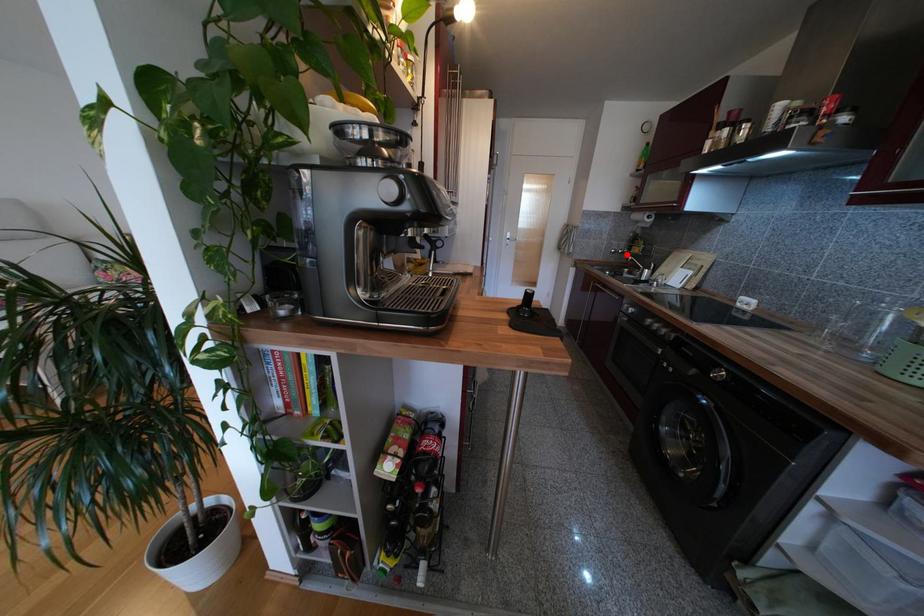
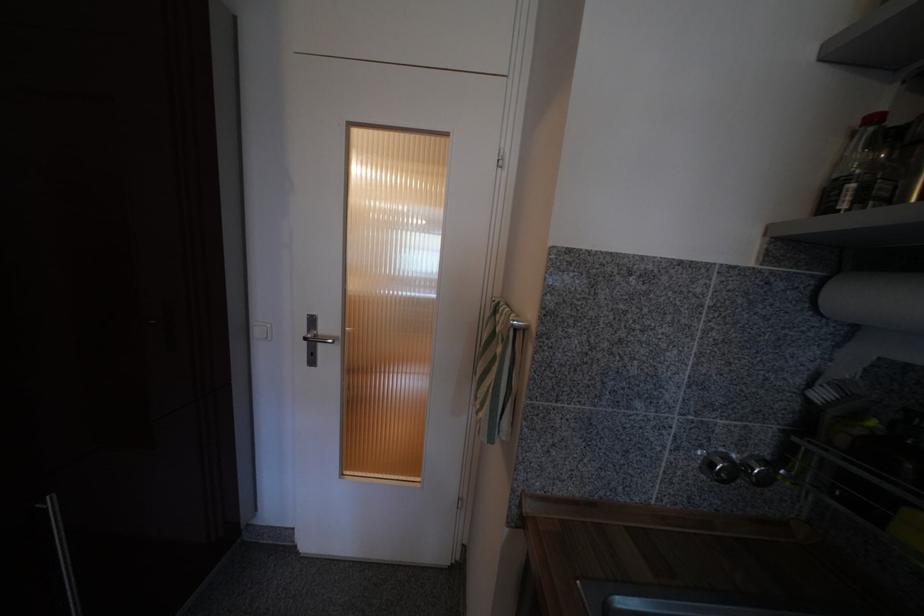
In the second image, find the point that corresponds to the highlighted location in the first image.

(772, 482)